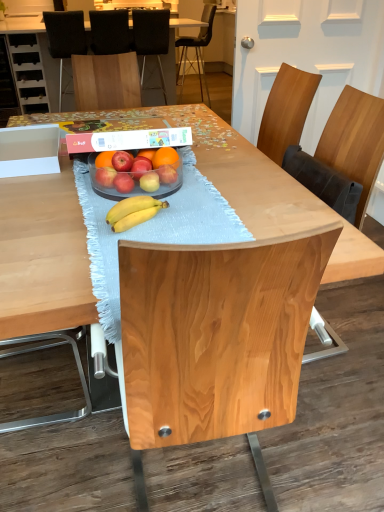
What are the coordinates of `free location in front of orangesmoothfruit at center` in the screenshot? It's located at [172, 195].